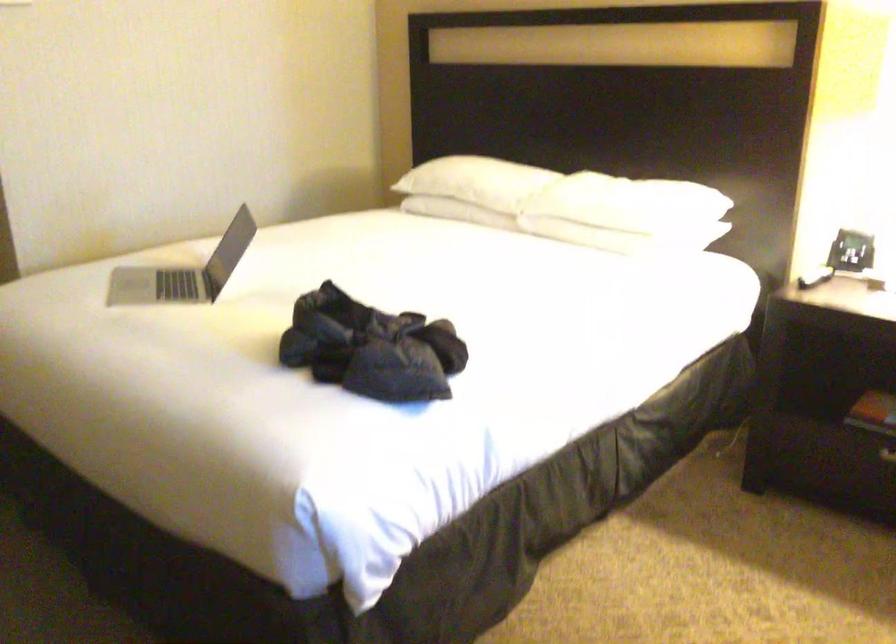
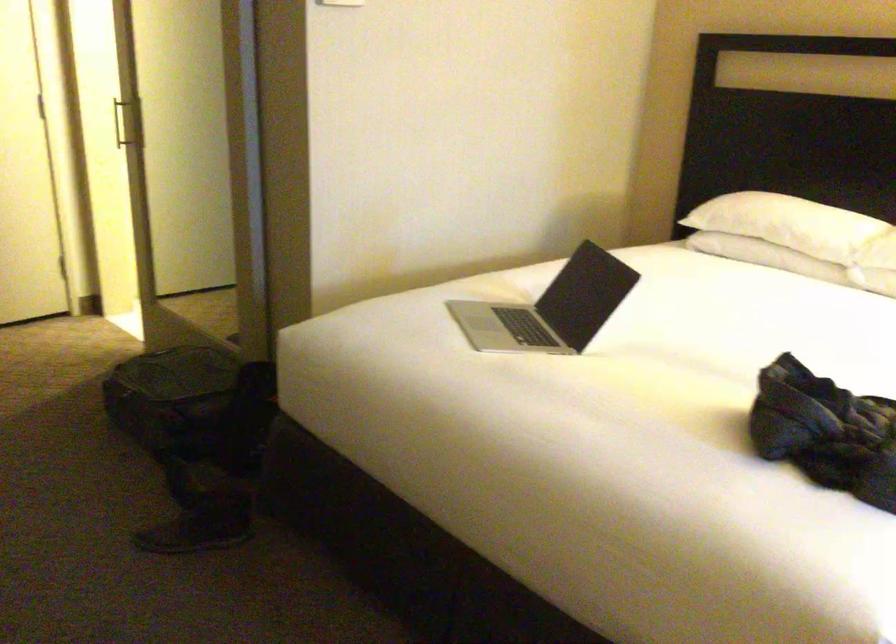
Question: Based on the continuous images, in which direction is the camera rotating? Reply with the corresponding letter.

Choices:
 (A) Left
 (B) Right
 (C) Up
 (D) Down

Answer: (A)